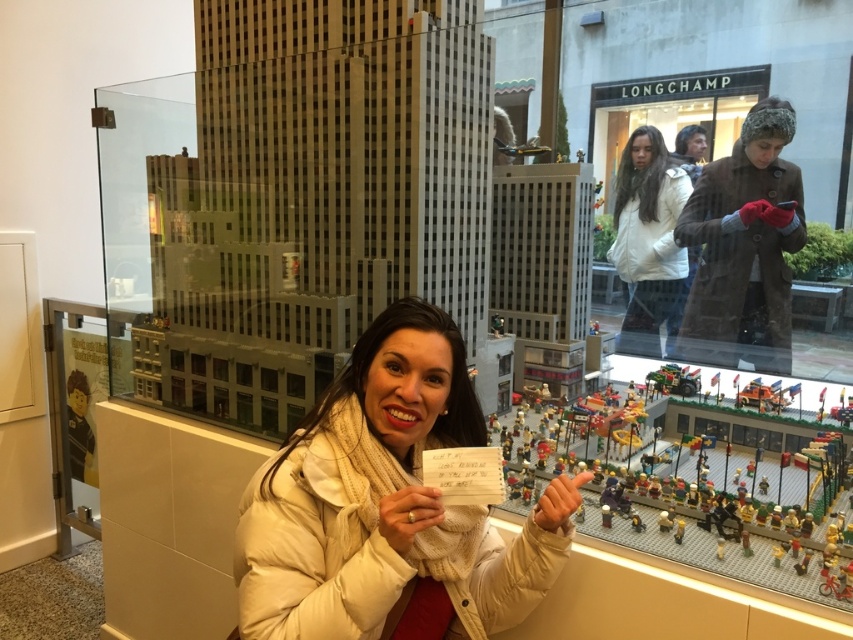
Question: Is brown woolen hat at upper right to the left of white matte jacket at upper center from the viewer's perspective?

Choices:
 (A) no
 (B) yes

Answer: (A)

Question: Which point is farther to the camera?

Choices:
 (A) (312, 490)
 (B) (775, 353)

Answer: (B)

Question: From the image, what is the correct spatial relationship of white puffy coat at center in relation to green plastic car at center?

Choices:
 (A) above
 (B) below

Answer: (B)

Question: Which point is farther to the camera?

Choices:
 (A) (616, 460)
 (B) (303, 422)
 (C) (637, 205)

Answer: (C)

Question: Which of the following is the closest to the observer?

Choices:
 (A) green plastic car at center
 (B) brown woolen hat at upper right
 (C) brick-like lego set at center

Answer: (C)

Question: Can you confirm if white puffy coat at center is thinner than white matte jacket at upper center?

Choices:
 (A) yes
 (B) no

Answer: (B)